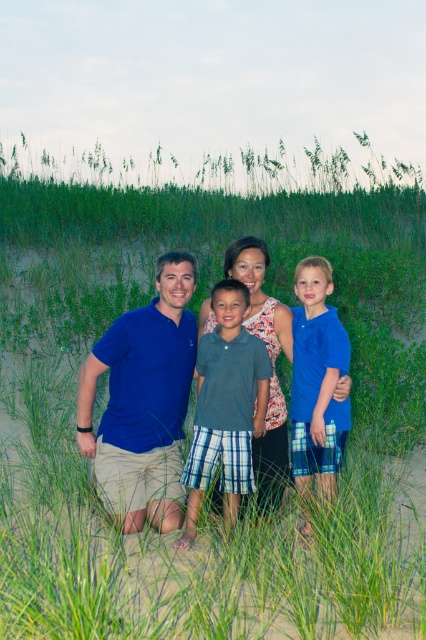
Question: Which object appears closest to the camera in this image?

Choices:
 (A) blue cotton shirt at center
 (B) blue cotton shirt at right
 (C) gray plaid shorts at center
 (D) matte blue polo shirt at left

Answer: (B)

Question: Can you confirm if matte blue polo shirt at left is smaller than blue cotton shirt at center?

Choices:
 (A) no
 (B) yes

Answer: (A)

Question: Does blue cotton shirt at right lie behind blue cotton shirt at center?

Choices:
 (A) yes
 (B) no

Answer: (B)

Question: Which of the following is the farthest from the observer?

Choices:
 (A) blue cotton shirt at center
 (B) blue cotton shirt at right
 (C) gray plaid shorts at center
 (D) matte blue polo shirt at left

Answer: (A)

Question: Based on their relative distances, which object is nearer to the blue cotton shirt at right?

Choices:
 (A) blue cotton shirt at center
 (B) gray plaid shorts at center

Answer: (A)

Question: Can you confirm if matte blue polo shirt at left is bigger than blue cotton shirt at center?

Choices:
 (A) yes
 (B) no

Answer: (A)